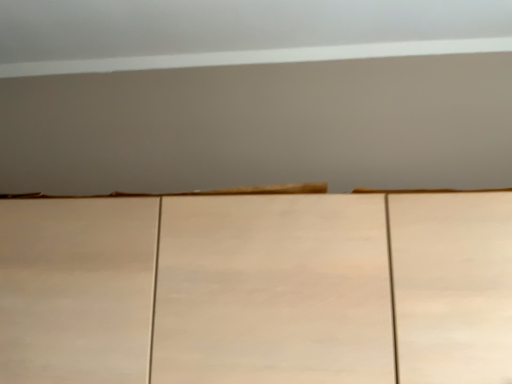
What do you see at coordinates (257, 288) in the screenshot? This screenshot has width=512, height=384. I see `matte wood cupboard at center` at bounding box center [257, 288].

Find the location of a particular element. The width and height of the screenshot is (512, 384). matte wood cupboard at center is located at coordinates (257, 288).

Measure the distance between point [170,376] and camera.

The depth of point [170,376] is 31.54 inches.

Identify the location of matte wood cupboard at center. The image size is (512, 384). (257, 288).